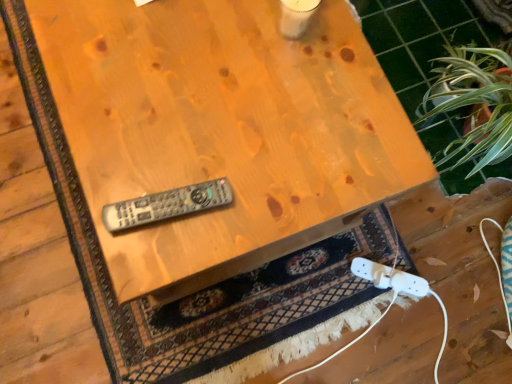
Question: Is wooden remote control at center turned away from wooden table at upper right?

Choices:
 (A) no
 (B) yes

Answer: (A)

Question: Is wooden remote control at center closer to camera compared to wooden table at upper right?

Choices:
 (A) yes
 (B) no

Answer: (A)

Question: Does wooden remote control at center appear on the left side of wooden table at upper right?

Choices:
 (A) yes
 (B) no

Answer: (A)

Question: Considering the relative sizes of wooden remote control at center and wooden table at upper right in the image provided, is wooden remote control at center shorter than wooden table at upper right?

Choices:
 (A) yes
 (B) no

Answer: (B)

Question: Would you say wooden remote control at center is a long distance from wooden table at upper right?

Choices:
 (A) yes
 (B) no

Answer: (B)

Question: Can you confirm if wooden remote control at center is bigger than wooden table at upper right?

Choices:
 (A) no
 (B) yes

Answer: (B)

Question: Is green leafy plant at upper right facing towards wooden table at upper right?

Choices:
 (A) no
 (B) yes

Answer: (A)

Question: From the image's perspective, does green leafy plant at upper right appear higher than wooden table at upper right?

Choices:
 (A) yes
 (B) no

Answer: (B)

Question: Does green leafy plant at upper right have a lesser width compared to wooden table at upper right?

Choices:
 (A) yes
 (B) no

Answer: (A)

Question: Considering the relative sizes of green leafy plant at upper right and wooden table at upper right in the image provided, is green leafy plant at upper right smaller than wooden table at upper right?

Choices:
 (A) no
 (B) yes

Answer: (B)

Question: From a real-world perspective, is green leafy plant at upper right physically below wooden table at upper right?

Choices:
 (A) no
 (B) yes

Answer: (A)

Question: Is green leafy plant at upper right outside wooden table at upper right?

Choices:
 (A) yes
 (B) no

Answer: (A)

Question: Is wooden table at upper right aimed at gray plastic remote at center?

Choices:
 (A) no
 (B) yes

Answer: (A)